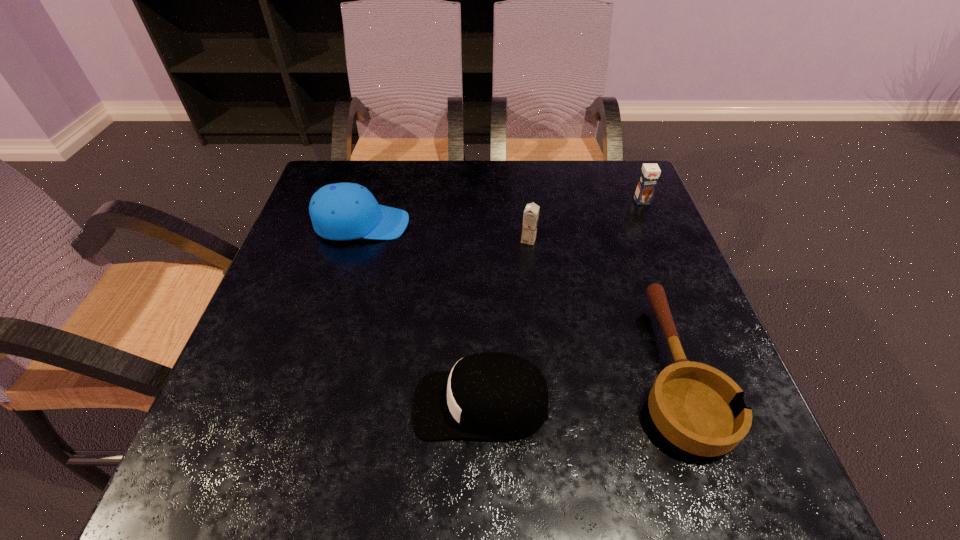
In the image, there is a desktop. Identify the location of vacant space at the near left corner. (210, 444).

You are a GUI agent. You are given a task and a screenshot of the screen. Output one action in this format:
    pyautogui.click(x=<x>, y=<y>)
    Task: Click on the blank space at the far right corner
    This screenshot has height=540, width=960.
    Given the screenshot: What is the action you would take?
    pyautogui.click(x=637, y=182)

Find the location of `vacant space at the near right corner of the desktop`. vacant space at the near right corner of the desktop is located at coordinates (675, 459).

Locate an element on the screen. Image resolution: width=960 pixels, height=540 pixels. free space between the farther cap and the right cap is located at coordinates (421, 314).

The image size is (960, 540). Identify the location of free spot between the left chocolate milk and the shortest object. (600, 306).

Where is `vacant area that lies between the nearer chocolate milk and the farthest object`? Image resolution: width=960 pixels, height=540 pixels. vacant area that lies between the nearer chocolate milk and the farthest object is located at coordinates (585, 220).

This screenshot has height=540, width=960. Find the location of `blank region between the shortest object and the farther cap`. blank region between the shortest object and the farther cap is located at coordinates pyautogui.click(x=516, y=298).

Locate an element on the screen. The width and height of the screenshot is (960, 540). vacant area that lies between the farther cap and the shortest object is located at coordinates (516, 298).

In order to click on vacant area between the leftmost object and the nearer chocolate milk in this screenshot , I will do `click(445, 232)`.

Where is `free spot between the farther chocolate milk and the leftmost object`? free spot between the farther chocolate milk and the leftmost object is located at coordinates (502, 212).